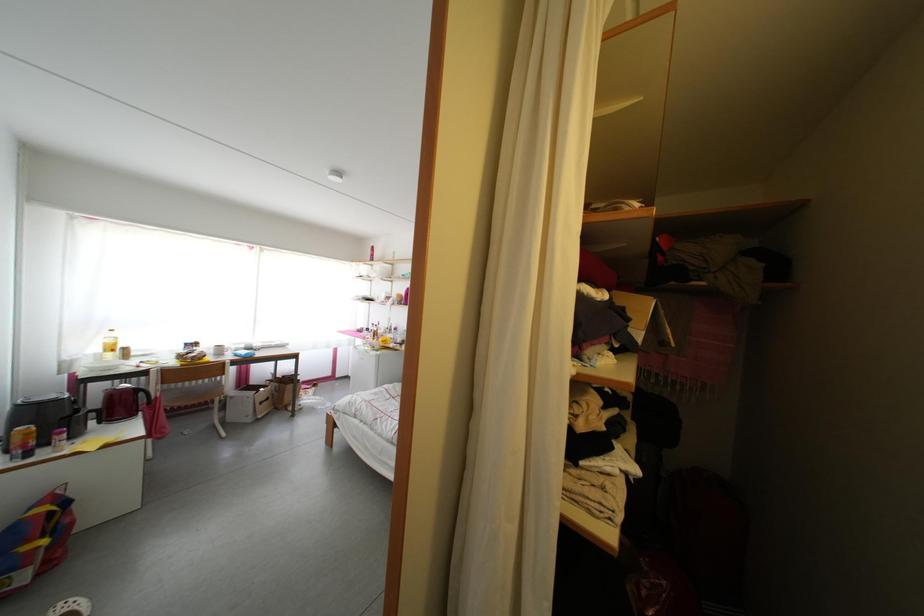
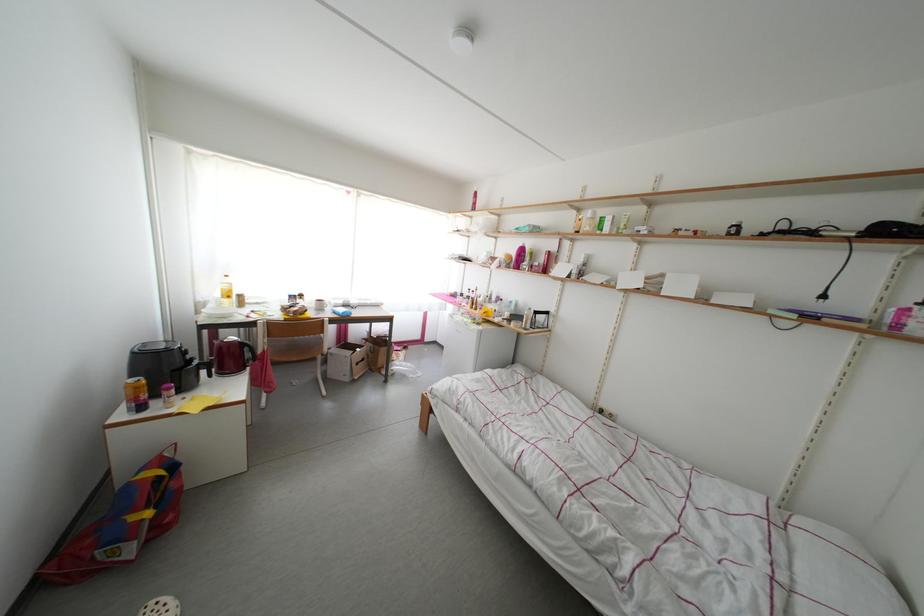
Question: The first image is from the beginning of the video and the second image is from the end. How did the camera likely rotate when shooting the video?

Choices:
 (A) Left
 (B) Right
 (C) Up
 (D) Down

Answer: (A)